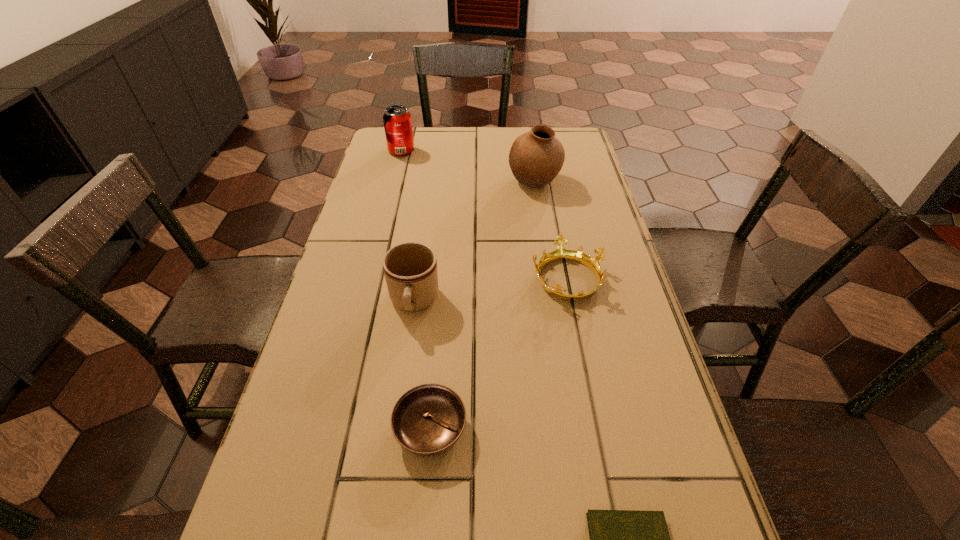
In the image, there is a desktop. Where is `vacant space at the left edge`? vacant space at the left edge is located at coordinates (402, 232).

In the image, there is a desktop. Find the location of `free space at the right edge`. free space at the right edge is located at coordinates (595, 217).

Where is `free space at the far left corner of the desktop`? This screenshot has height=540, width=960. free space at the far left corner of the desktop is located at coordinates (x=374, y=147).

In the image, there is a desktop. Identify the location of free space at the far right corner. Image resolution: width=960 pixels, height=540 pixels. (578, 155).

In order to click on free spot between the crown and the second farthest object in this screenshot , I will do `click(550, 230)`.

In order to click on unoccupied position between the crown and the mug in this screenshot , I will do `click(491, 290)`.

I want to click on free spot between the fourth shortest object and the second farthest object, so click(474, 242).

The width and height of the screenshot is (960, 540). I want to click on vacant area that lies between the tallest object and the third tallest object, so 474,242.

You are a GUI agent. You are given a task and a screenshot of the screen. Output one action in this format:
    pyautogui.click(x=<x>, y=<y>)
    Task: Click on the free space between the tallest object and the crown
    This screenshot has height=540, width=960.
    Given the screenshot: What is the action you would take?
    pyautogui.click(x=550, y=230)

Image resolution: width=960 pixels, height=540 pixels. I want to click on free point between the mug and the fourth tallest object, so click(x=491, y=290).